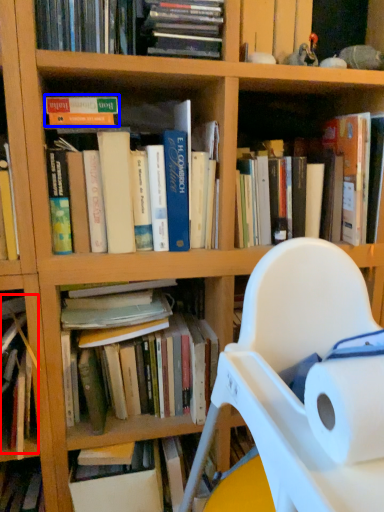
Question: Which point is closer to the camera, book (highlighted by a red box) or book (highlighted by a blue box)?

Choices:
 (A) book
 (B) book

Answer: (B)